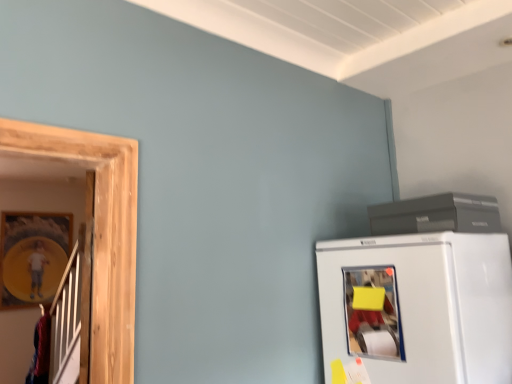
Question: In the image, is wooden framed picture at left on the left side or the right side of yellow matte paper at lower right?

Choices:
 (A) left
 (B) right

Answer: (A)

Question: Considering the positions of point (27, 301) and point (365, 304), is point (27, 301) closer or farther from the camera than point (365, 304)?

Choices:
 (A) closer
 (B) farther

Answer: (B)

Question: Considering the real-world distances, which object is closest to the yellow matte paper at lower right?

Choices:
 (A) wooden framed picture at left
 (B) matte gray printer at upper right
 (C) white matte refrigerator at lower right

Answer: (C)

Question: Based on their relative distances, which object is farther from the matte gray printer at upper right?

Choices:
 (A) wooden framed picture at left
 (B) white matte refrigerator at lower right
 (C) yellow matte paper at lower right

Answer: (A)